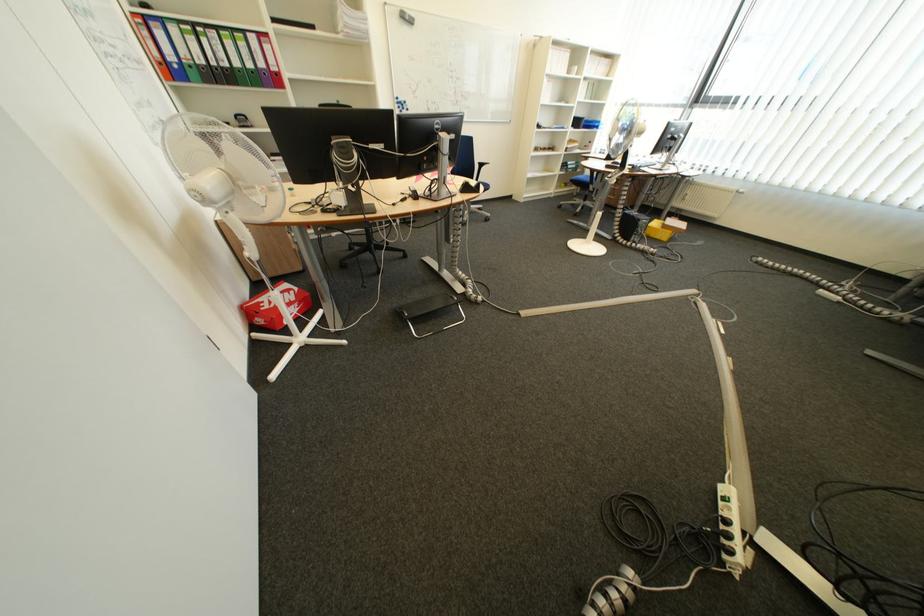
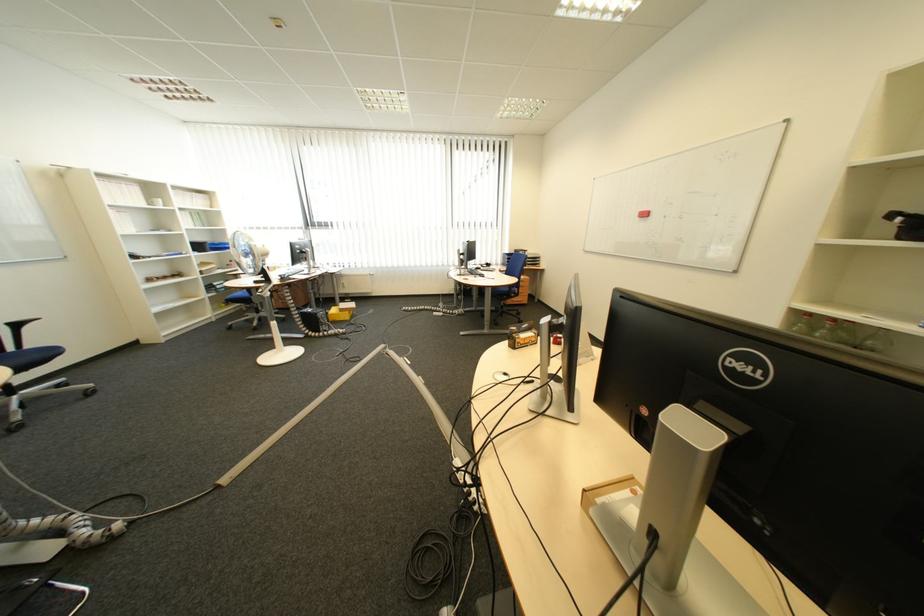
The point at (657,227) is marked in the first image. Where is the corresponding point in the second image?

(335, 317)